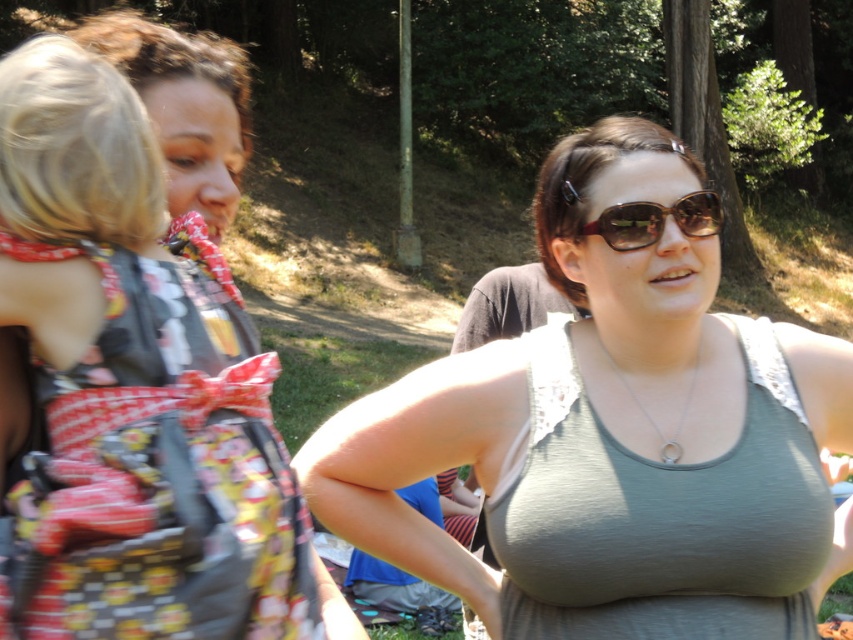
You are a photographer setting up a tripod to take a portrait of the two women in the scene. The matte black dress at upper left and the sunglasses at center are both in your frame. Based on their positions, which object should you focus on first to ensure proper depth of field?

The matte black dress at upper left has a greater height compared to sunglasses at center, so you should focus on the matte black dress at upper left first to ensure proper depth of field.

You are a photographer setting up a tripod in the park scene. You notice the matte black dress at upper left and the sunglasses at center. Which object has a greater width according to the scene?

The matte black dress at upper left has a greater width than the sunglasses at center.

You are standing in a park and see a woman wearing a matte black dress at upper left and someone wearing sunglasses at center. Which object is positioned more to the right?

The sunglasses at center is positioned more to the right than the matte black dress at upper left.